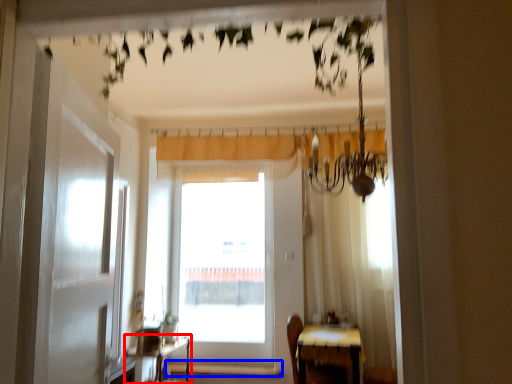
Question: Which of the following is the farthest to the observer, table (highlighted by a red box) or window sill (highlighted by a blue box)?

Choices:
 (A) table
 (B) window sill

Answer: (B)